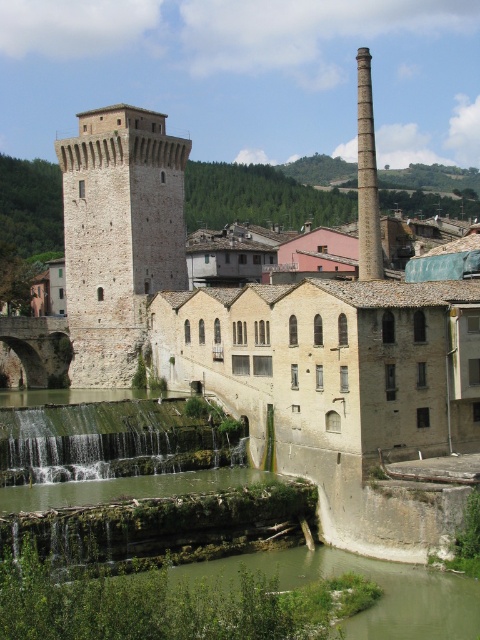
Who is lower down, smooth stone chimney at upper center or smooth gray chimney at upper right?

smooth stone chimney at upper center

How far apart are smooth stone chimney at upper center and smooth gray chimney at upper right?

smooth stone chimney at upper center is 123.05 feet away from smooth gray chimney at upper right.

Does point (152, 284) come farther from viewer compared to point (377, 205)?

Yes, point (152, 284) is behind point (377, 205).

This screenshot has height=640, width=480. In order to click on smooth stone chimney at upper center in this screenshot , I will do `click(119, 236)`.